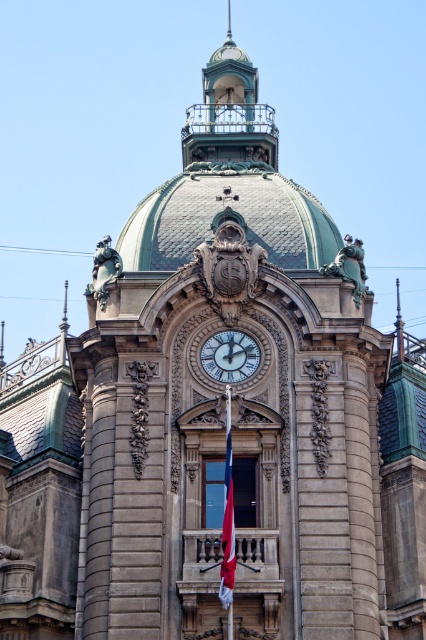
You are standing in front of a grand building and notice a white glossy clock at center and a red fabric flag at center. Which object is positioned to the right of the other?

The white glossy clock at center is to the right of the red fabric flag at center.

You are an architect analyzing the symmetry of the building. The white glossy clock at center is located at point (230, 355). Is there any other object at this coordinate? Please answer based on the provided information.

Yes, the white glossy clock at center is located at point (230, 355).